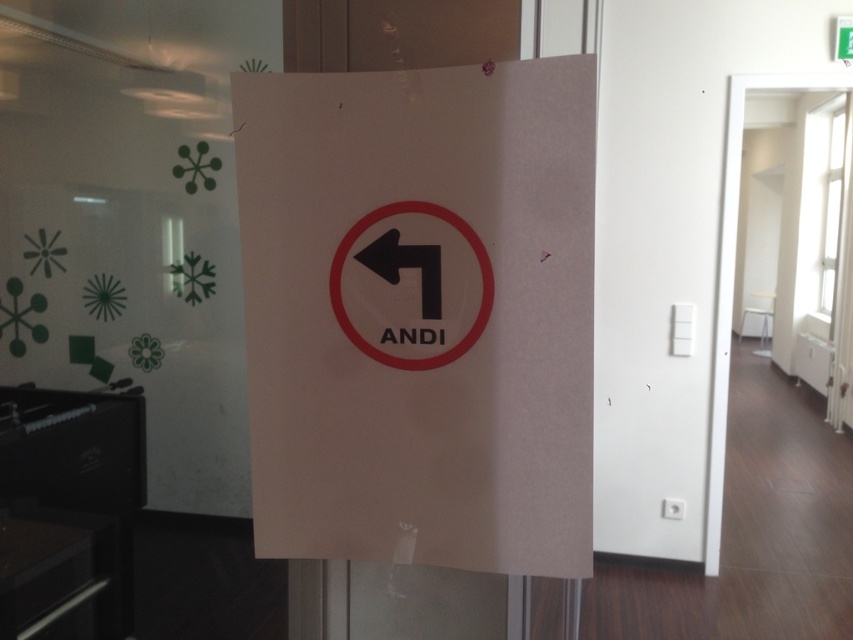
Question: Does black plastic sign at center lie behind white paper sign at center?

Choices:
 (A) yes
 (B) no

Answer: (B)

Question: Which object appears closest to the camera in this image?

Choices:
 (A) black plastic sign at center
 (B) white paper sign at center
 (C) black matte arrow at center

Answer: (A)

Question: Does black plastic sign at center have a larger size compared to black matte arrow at center?

Choices:
 (A) yes
 (B) no

Answer: (A)

Question: Which of the following is the farthest from the observer?

Choices:
 (A) black matte arrow at center
 (B) white paper sign at center

Answer: (B)

Question: Which of these objects is positioned closest to the white paper sign at center?

Choices:
 (A) black matte arrow at center
 (B) black plastic sign at center

Answer: (B)

Question: Observing the image, what is the correct spatial positioning of black matte arrow at center in reference to white paper sign at center?

Choices:
 (A) below
 (B) above

Answer: (A)